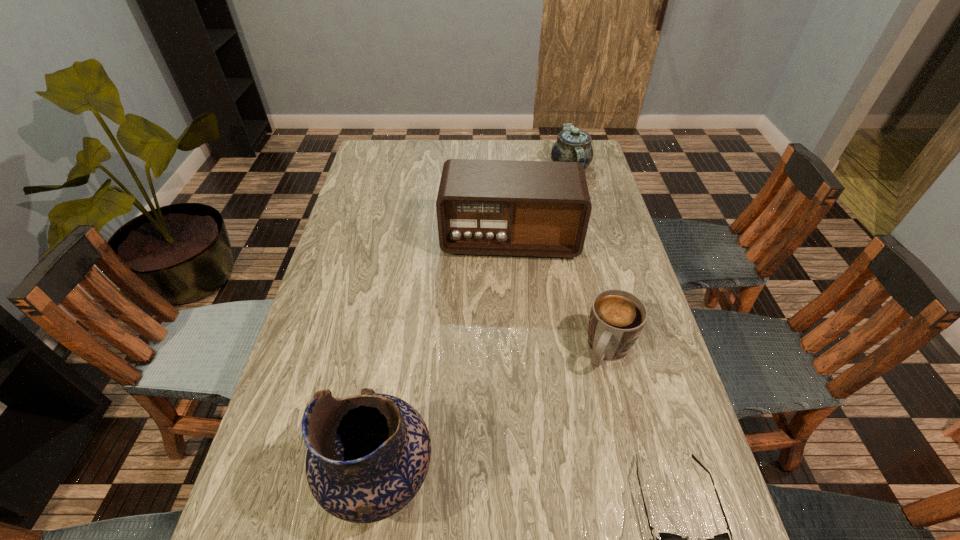
Find the location of a particular element. This screenshot has width=960, height=540. free space located 0.050m from the spout of the farthest object is located at coordinates (568, 193).

The height and width of the screenshot is (540, 960). What are the coordinates of `vacant space located 0.160m from the spout of the farthest object` in the screenshot? It's located at (565, 212).

Where is `blank space located 0.270m from the spout of the farthest object`? This screenshot has width=960, height=540. blank space located 0.270m from the spout of the farthest object is located at coordinates (562, 232).

You are a GUI agent. You are given a task and a screenshot of the screen. Output one action in this format:
    pyautogui.click(x=<x>, y=<y>)
    Task: Click on the object at the far edge
    This screenshot has width=960, height=540.
    Given the screenshot: What is the action you would take?
    pyautogui.click(x=572, y=145)

At what (x,y) coordinates should I click in order to perform the action: click on mug present at the right edge. Please return your answer as a coordinate pair (x, y). The height and width of the screenshot is (540, 960). Looking at the image, I should click on (617, 317).

The width and height of the screenshot is (960, 540). Find the location of `radio receiver located in the right edge section of the desktop`. radio receiver located in the right edge section of the desktop is located at coordinates (513, 208).

The height and width of the screenshot is (540, 960). What are the coordinates of `chinaware that is at the right edge` in the screenshot? It's located at (572, 145).

I want to click on object located in the far right corner section of the desktop, so click(572, 145).

In the image, there is a desktop. Identify the location of vacant space at the far edge. (467, 154).

The image size is (960, 540). Identify the location of free spot at the near edge of the desktop. (556, 507).